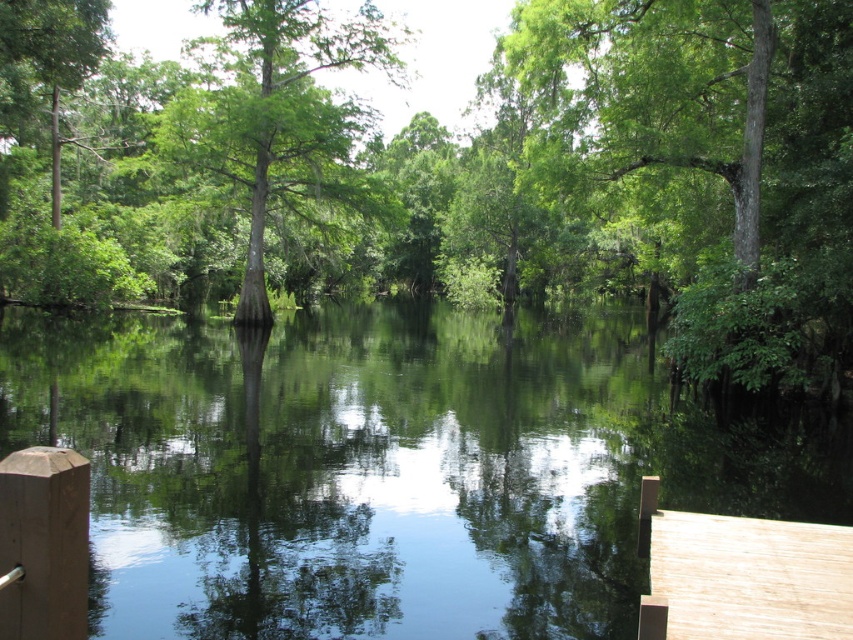
You are standing on the wooden dock and looking towards the center of the image. Which object, the green reflective water at center or the green matte tree at center, is positioned to the right of the other?

The green reflective water at center is to the right of the green matte tree at center.

You are standing at the edge of the dock and want to throw a pebble into the water. If you aim for the point labeled point (74, 266) and the point labeled point (291, 179), which point will land closer to you after hitting the water?

Point (74, 266) is closer to you than point (291, 179), so the pebble aimed at point (74, 266) will land closer to you after hitting the water.

Looking at this image, you are an artist trying to paint the scene. You need to decide which object to paint first based on their sizes. Which one should you start with, the green reflective water at center or the green matte tree at center?

You should start with the green reflective water at center because it is smaller in size compared to the green matte tree at center, allowing you to detail it before moving on to the larger area of the tree.